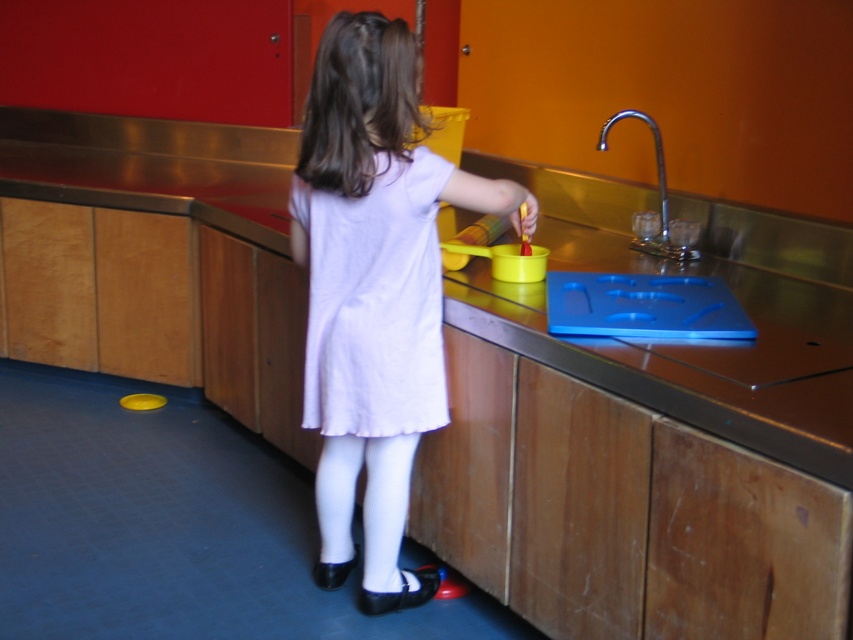
You are a photographer trying to capture a clear shot of both the white matte dress at center and the silver metallic faucet at upper right. Since you can only focus on one object at a time, which object should you focus on first to ensure the other remains in the background?

You should focus on the white matte dress at center first because it is closer to the viewer, and the silver metallic faucet at upper right will naturally be in the background when the dress is in focus.

You are a parent trying to ensure your child stays safe while playing in the kitchen. The white cotton dress at center is currently 33.72 inches away from the silver metallic faucet at upper right. If the recommended safety distance between the child and the faucet is at least 24 inches, is the current distance sufficient?

The distance between the white cotton dress at center and the silver metallic faucet at upper right is 33.72 inches, which exceeds the recommended safety distance of 24 inches. Therefore, the current distance is sufficient for safety.